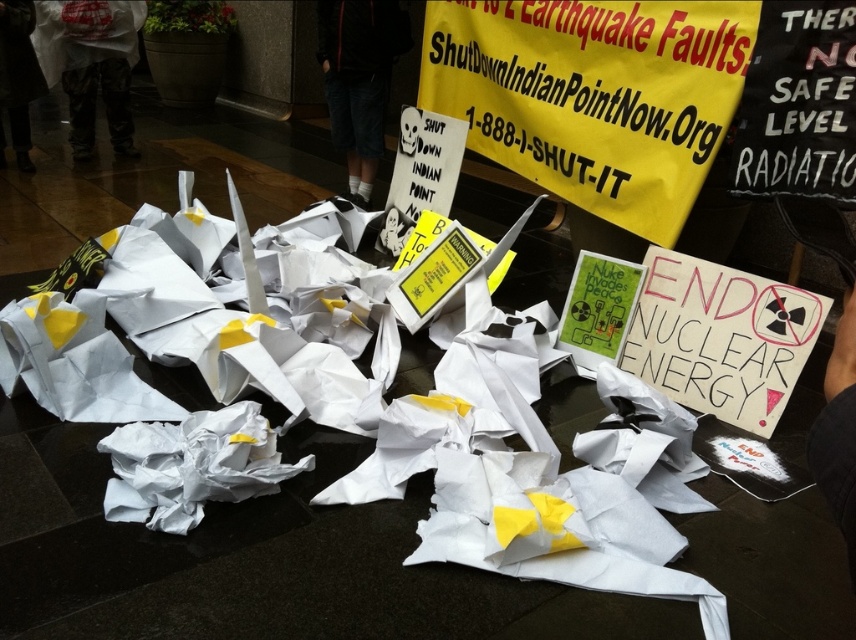
Question: Which of the following is the closest to the observer?

Choices:
 (A) (99, 60)
 (B) (393, 42)
 (C) (247, 417)

Answer: (C)

Question: Which point appears closest to the camera in this image?

Choices:
 (A) (64, 68)
 (B) (352, 115)
 (C) (308, 262)

Answer: (C)

Question: Does white cotton shorts at center have a lesser width compared to camouflage pants at left?

Choices:
 (A) yes
 (B) no

Answer: (A)

Question: Considering the relative positions of white crumpled paper at center and camouflage pants at left in the image provided, where is white crumpled paper at center located with respect to camouflage pants at left?

Choices:
 (A) above
 (B) below

Answer: (B)

Question: Considering the real-world distances, which object is closest to the white cotton shorts at center?

Choices:
 (A) white crumpled paper at center
 (B) camouflage pants at left

Answer: (B)

Question: Does white crumpled paper at center come in front of camouflage pants at left?

Choices:
 (A) no
 (B) yes

Answer: (B)